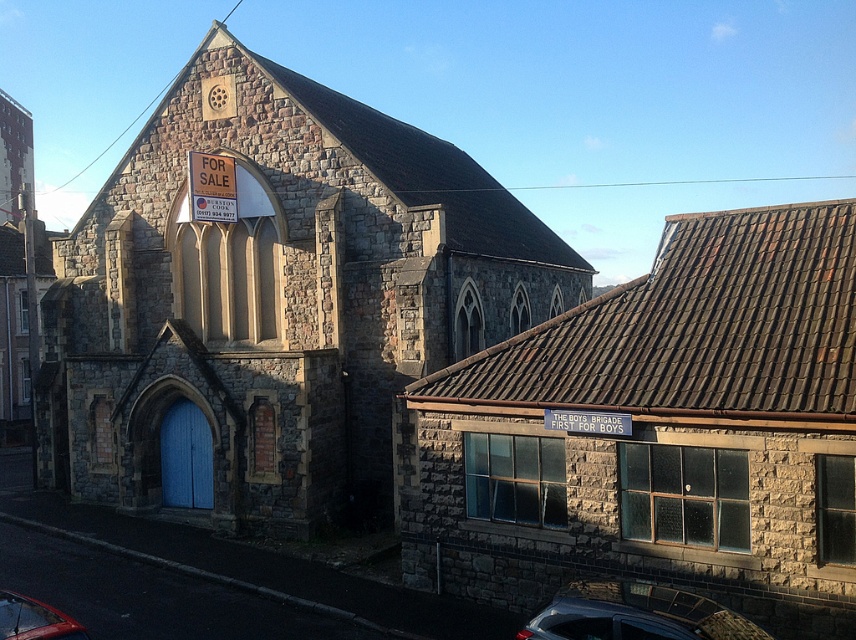
Question: Is stone tiled roof at upper right to the right of silver metallic car at lower right from the viewer's perspective?

Choices:
 (A) yes
 (B) no

Answer: (A)

Question: Which of these objects is positioned farthest from the stone textured chapel at center?

Choices:
 (A) stone tiled roof at upper right
 (B) shiny red car at lower left
 (C) silver metallic car at lower right

Answer: (B)

Question: Which object is closer to the camera taking this photo?

Choices:
 (A) shiny red car at lower left
 (B) stone textured chapel at center
 (C) stone tiled roof at upper right

Answer: (A)

Question: Which point is farther from the camera taking this photo?

Choices:
 (A) (849, 360)
 (B) (688, 636)
 (C) (360, 429)

Answer: (C)

Question: Is stone tiled roof at upper right closer to the viewer compared to shiny red car at lower left?

Choices:
 (A) no
 (B) yes

Answer: (A)

Question: Can you confirm if stone textured chapel at center is positioned below shiny red car at lower left?

Choices:
 (A) yes
 (B) no

Answer: (B)